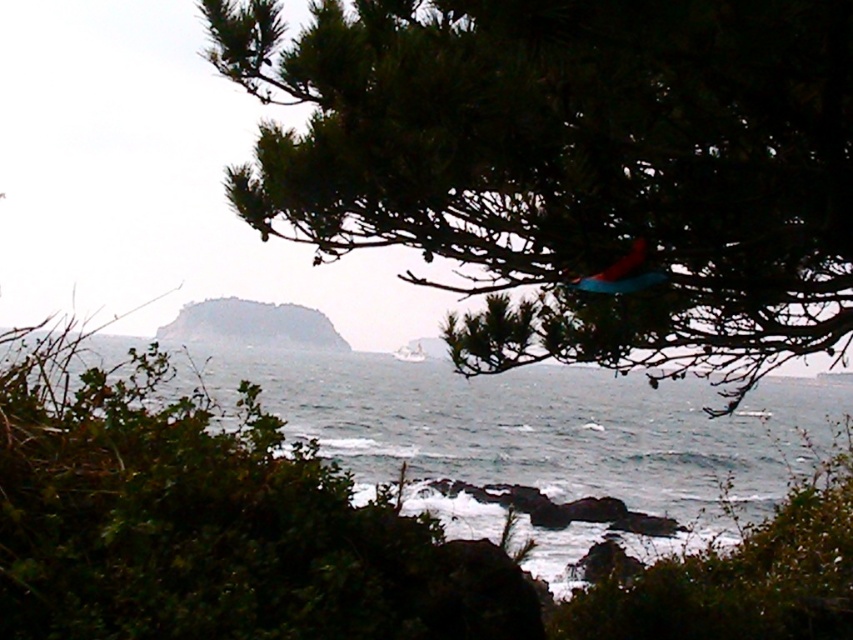
Which is in front, point (410, 76) or point (592, 465)?

Point (410, 76) is in front.

Is green matte tree at upper center positioned in front of dark blue water at center?

Yes, it is.

The width and height of the screenshot is (853, 640). Identify the location of green matte tree at upper center. (572, 164).

Is dark blue water at center further to camera compared to matte blue kite at upper center?

No, dark blue water at center is closer to the viewer.

Can you confirm if dark blue water at center is bigger than matte blue kite at upper center?

Correct, dark blue water at center is larger in size than matte blue kite at upper center.

Where is `dark blue water at center`? dark blue water at center is located at coordinates (538, 438).

Can you confirm if green matte tree at upper center is positioned to the right of matte blue kite at upper center?

In fact, green matte tree at upper center is to the left of matte blue kite at upper center.

Can you confirm if green matte tree at upper center is positioned to the left of matte blue kite at upper center?

Indeed, green matte tree at upper center is positioned on the left side of matte blue kite at upper center.

Does point (292, 90) come farther from viewer compared to point (654, 269)?

Yes, point (292, 90) is farther from viewer.

Where is `green matte tree at upper center`? The image size is (853, 640). green matte tree at upper center is located at coordinates (572, 164).